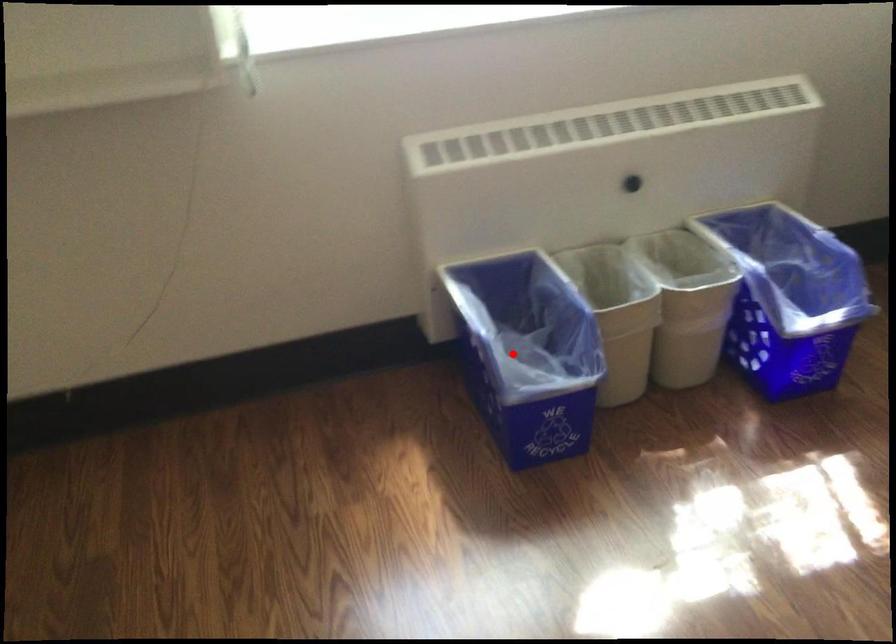
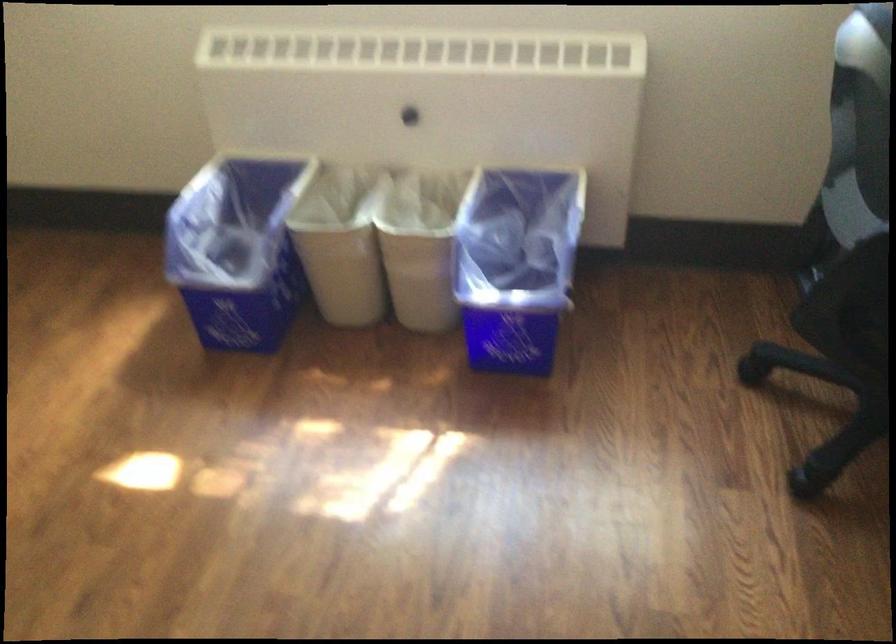
Find the pixel in the second image that matches the highlighted location in the first image.

(237, 249)